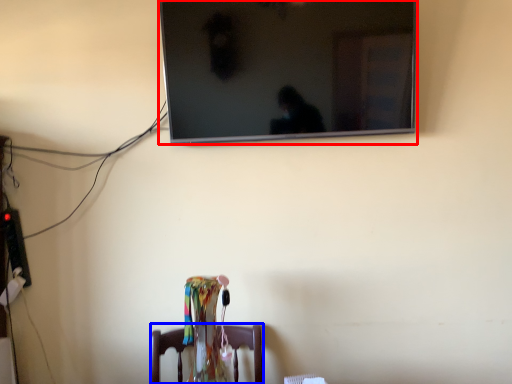
Question: Among these objects, which one is farthest to the camera, television (highlighted by a red box) or furniture (highlighted by a blue box)?

Choices:
 (A) television
 (B) furniture

Answer: (A)